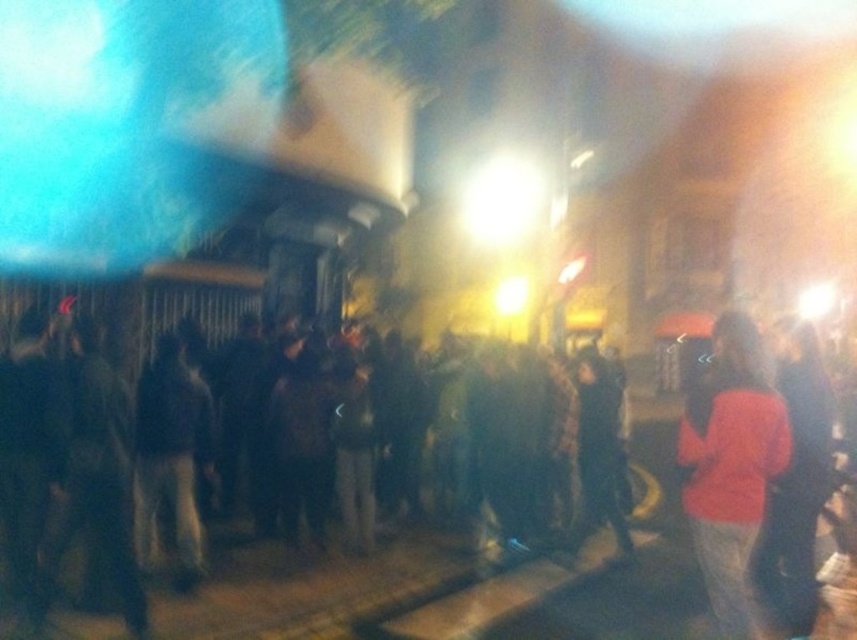
You are standing in the nighttime scene and want to move from the point at coordinates point (304, 424) to the point at coordinates point (746, 394). Which direction should you move to get closer to the latter?

Since point (304, 424) is further to the camera than point (746, 394), you should move towards the direction of the camera to reach the latter point.

You are a photographer trying to capture a clear shot of the dark matte clothing at center and the orange fabric shirt at right. Given the scene is blurry due to low light, which subject would be easier to focus on and why?

The dark matte clothing at center is much taller than the orange fabric shirt at right, so it would be easier to focus on because larger subjects are generally easier to capture clearly in low light conditions.

Consider the image. You are standing in the nighttime crowd and want to locate two specific people. One is wearing dark matte clothing at center and the other has an orange fabric shirt at right. Which one is positioned to the left when facing the same direction as the crowd?

The dark matte clothing at center is to the left of the orange fabric shirt at right, so the person in dark matte clothing at center is positioned to the left when facing the same direction as the crowd.